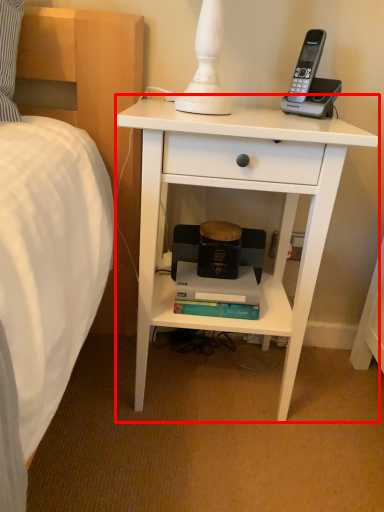
Question: Considering the relative positions of nightstand (annotated by the red box) and paperback book in the image provided, where is nightstand (annotated by the red box) located with respect to the staircase?

Choices:
 (A) right
 (B) left

Answer: (A)